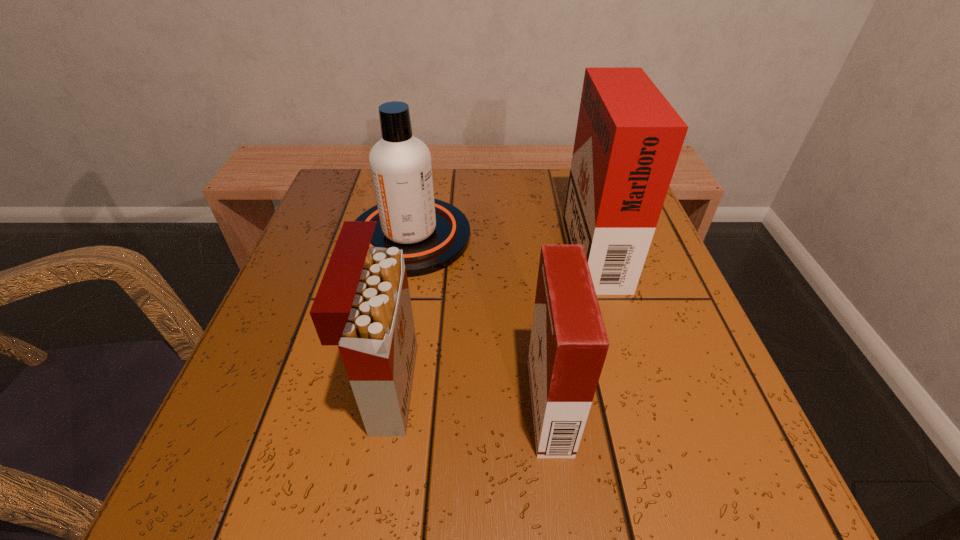
Find the location of a particular element. This screenshot has width=960, height=540. unoccupied position between the rightmost cigarette_case and the leftmost cigarette_case is located at coordinates (491, 315).

Image resolution: width=960 pixels, height=540 pixels. Find the location of `unoccupied position between the rightmost cigarette_case and the leftmost cigarette_case`. unoccupied position between the rightmost cigarette_case and the leftmost cigarette_case is located at coordinates (491, 315).

The width and height of the screenshot is (960, 540). Find the location of `empty location between the farthest cigarette_case and the leftmost cigarette_case`. empty location between the farthest cigarette_case and the leftmost cigarette_case is located at coordinates (491, 315).

Identify the location of object that can be found as the third closest to the farthest cigarette_case. pos(363,305).

Where is `object identified as the third closest to the leftmost cigarette_case`? This screenshot has height=540, width=960. object identified as the third closest to the leftmost cigarette_case is located at coordinates (628, 139).

Identify which cigarette_case is the closest to the rightmost cigarette_case. Please provide its 2D coordinates. Your answer should be formatted as a tuple, i.e. [(x, y)], where the tuple contains the x and y coordinates of a point satisfying the conditions above.

[(568, 346)]

Identify the location of cigarette_case that stands as the closest to the farthest cigarette_case. (568, 346).